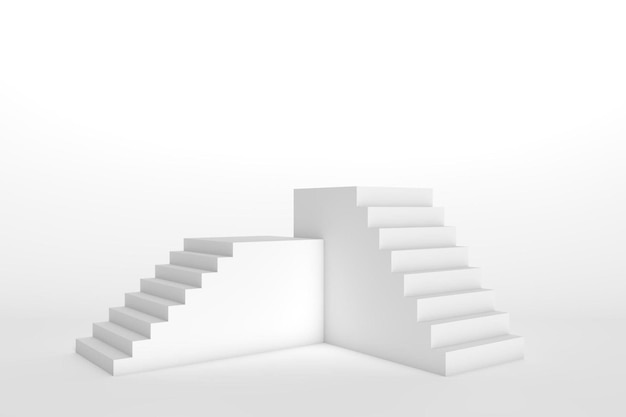
Locate an element on the screen. stail risers on right stairway is located at coordinates (500, 353), (471, 331), (464, 301), (446, 276), (437, 251), (423, 233), (416, 211), (403, 189).